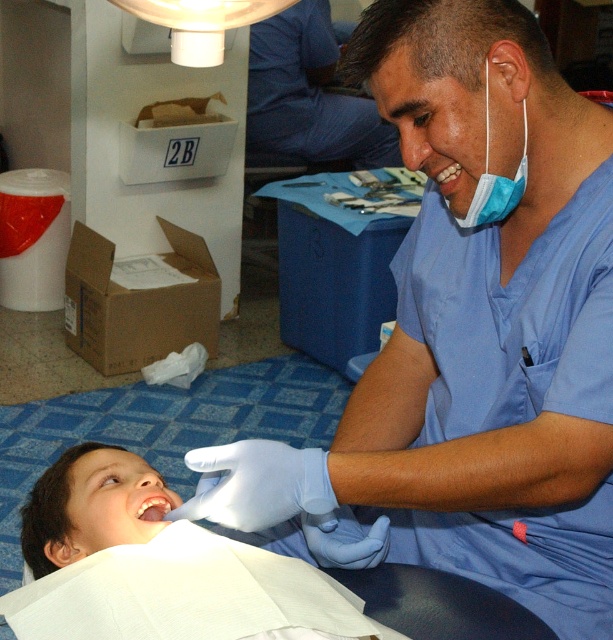
Question: Which is farther from the blue scrubs at upper right?

Choices:
 (A) glossy white teeth at lower center
 (B) white cloth napkin at lower left

Answer: (A)

Question: Does blue scrubs at upper right appear on the left side of blue surgical mask at upper right?

Choices:
 (A) no
 (B) yes

Answer: (B)

Question: Which point is farther to the camera?

Choices:
 (A) glossy white teeth at lower center
 (B) white cloth napkin at lower left

Answer: (A)

Question: Which point is closer to the camera?

Choices:
 (A) blue scrubs at upper right
 (B) white cloth napkin at lower left

Answer: (B)

Question: Can you confirm if white cloth napkin at lower left is smaller than blue surgical mask at upper right?

Choices:
 (A) yes
 (B) no

Answer: (B)

Question: Can you confirm if white cloth napkin at lower left is positioned to the right of glossy white teeth at lower center?

Choices:
 (A) yes
 (B) no

Answer: (B)